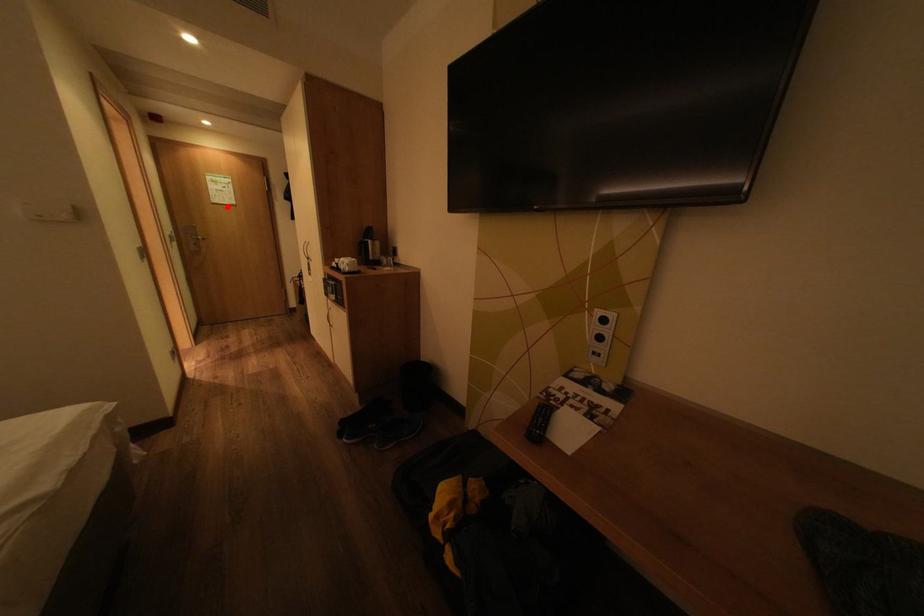
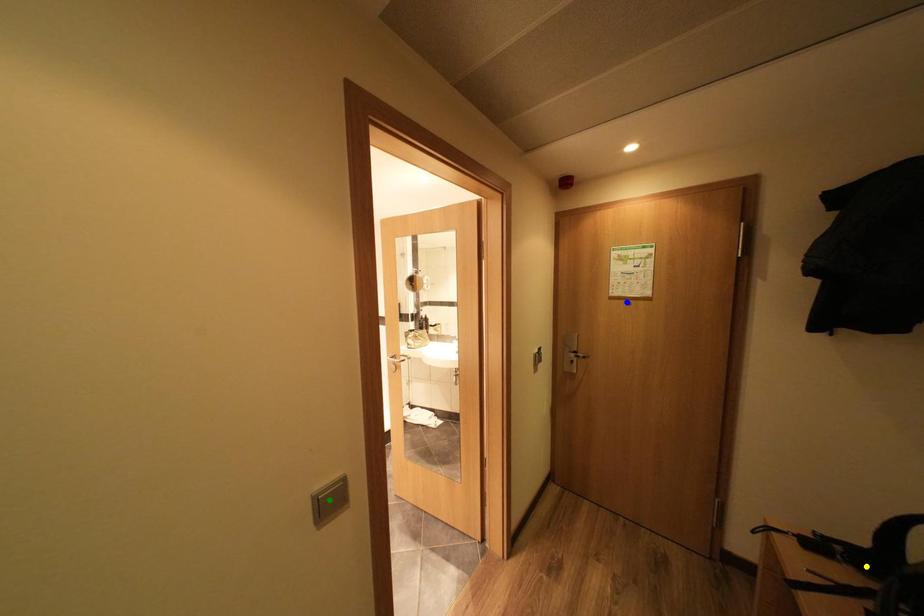
Question: I am providing you with two images of the same scene from different viewpoints. A red point is marked on the first image. You are given multiple points on the second image. Can you choose the point in image 2 that corresponds to the point in image 1?

Choices:
 (A) yellow point
 (B) green point
 (C) blue point

Answer: (C)